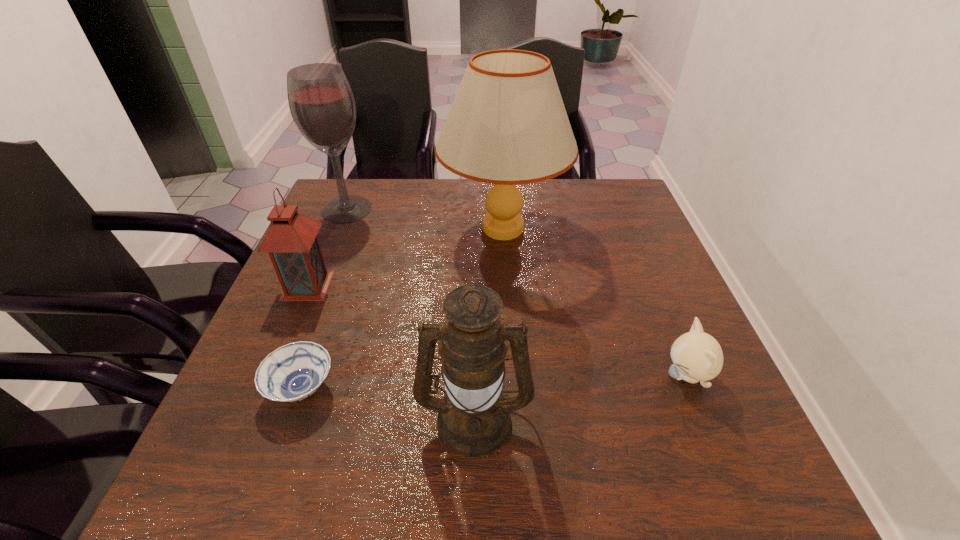
Locate an element on the screen. The height and width of the screenshot is (540, 960). lampshade is located at coordinates (507, 125).

At what (x,y) coordinates should I click in order to perform the action: click on alcohol. Please return your answer as a coordinate pair (x, y). This screenshot has width=960, height=540. Looking at the image, I should click on (321, 102).

This screenshot has height=540, width=960. What are the coordinates of `oil lamp` in the screenshot? It's located at (474, 420).

Image resolution: width=960 pixels, height=540 pixels. Identify the location of the third shortest object. (292, 244).

Where is `the third farthest object`? The image size is (960, 540). the third farthest object is located at coordinates (292, 244).

Identify the location of the second shortest object. This screenshot has width=960, height=540. 697,356.

Where is `the rightmost object`? The width and height of the screenshot is (960, 540). the rightmost object is located at coordinates (697, 356).

The height and width of the screenshot is (540, 960). In order to click on the shortest object in this screenshot , I will do `click(293, 372)`.

Where is `vacant space situated on the left of the lampshade`? This screenshot has width=960, height=540. vacant space situated on the left of the lampshade is located at coordinates (369, 228).

Find the location of `free space located 0.100m on the right of the alcohol`. free space located 0.100m on the right of the alcohol is located at coordinates (408, 209).